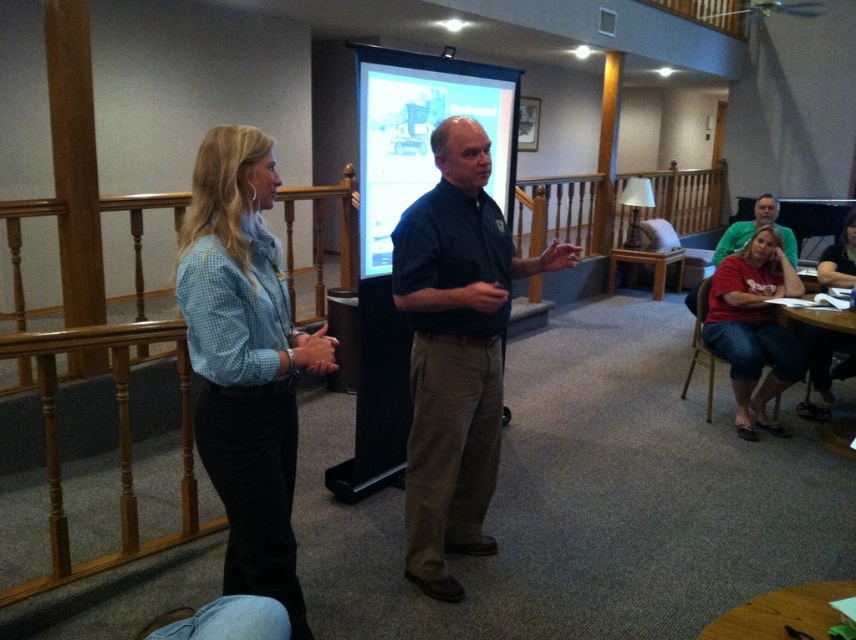
Question: Does dark blue shirt at center come behind matte black projector screen at center?

Choices:
 (A) no
 (B) yes

Answer: (A)

Question: Which point is farther to the camera?

Choices:
 (A) (705, 292)
 (B) (726, 257)

Answer: (B)

Question: Among these points, which one is nearest to the camera?

Choices:
 (A) (400, 84)
 (B) (771, 316)
 (C) (828, 253)
 (D) (450, 154)

Answer: (D)

Question: Can you confirm if matte black projector screen at center is thinner than green cotton shirt at right?

Choices:
 (A) no
 (B) yes

Answer: (A)

Question: Is dark blue shirt at center closer to camera compared to matte black projector screen at center?

Choices:
 (A) no
 (B) yes

Answer: (B)

Question: Considering the real-world distances, which object is closest to the matte black projector screen at center?

Choices:
 (A) red cotton shirt at lower right
 (B) denim shirt at lower right
 (C) light blue checkered shirt at center

Answer: (C)